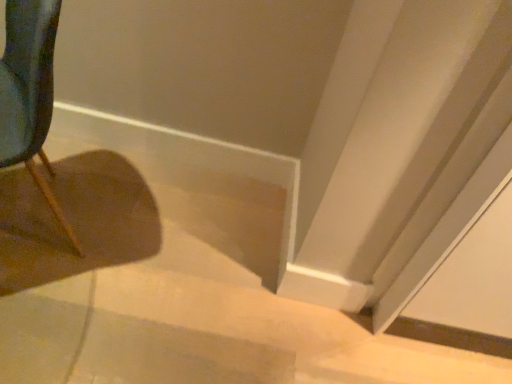
Find the location of a particular element. This screenshot has height=384, width=512. vacant space to the right of matte brown chair at left is located at coordinates (136, 242).